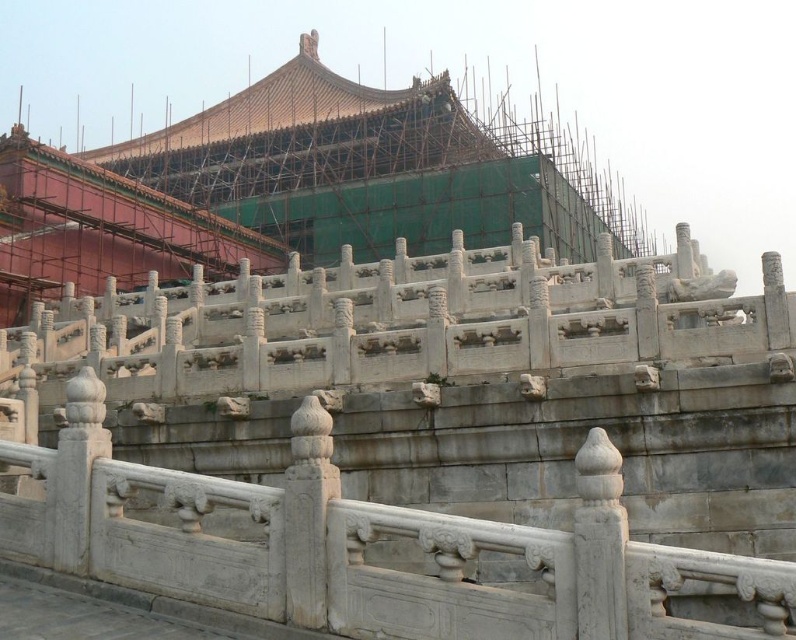
You are an architect examining the image of the traditional Chinese structure. You notice a point labeled at coordinates (418, 445). Based on the scene description, what architectural element is located at this point?

The point at coordinates (418, 445) indicates the location of the white stone railing at center.

You are standing in front of the traditional Chinese architectural structure. Where is the white stone railing at center located in terms of its 2D coordinates?

The white stone railing at center is located at the 2D coordinates of point [418,445].

You are an architect inspecting the renovation site of a traditional Chinese palace. You notice the white stone railing at center and the white stone palace at center. Which structure has a greater height?

The white stone palace at center is taller than the white stone railing at center.